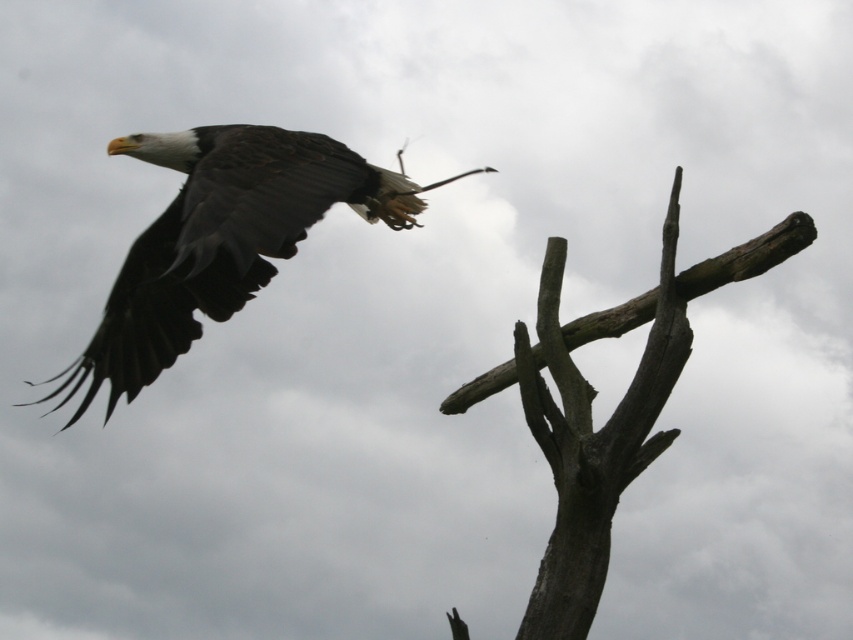
Question: Which object is closer to the camera taking this photo?

Choices:
 (A) dark brown feathers at upper left
 (B) gray rough wood at upper right

Answer: (A)

Question: Can you confirm if dark brown feathers at upper left is positioned to the right of gray rough wood at upper right?

Choices:
 (A) yes
 (B) no

Answer: (B)

Question: Considering the relative positions of dark brown feathers at upper left and gray rough wood at upper right in the image provided, where is dark brown feathers at upper left located with respect to gray rough wood at upper right?

Choices:
 (A) right
 (B) left

Answer: (B)

Question: Which point is closer to the camera taking this photo?

Choices:
 (A) (663, 221)
 (B) (271, 268)

Answer: (A)

Question: Does dark brown feathers at upper left appear on the left side of gray rough wood at upper right?

Choices:
 (A) no
 (B) yes

Answer: (B)